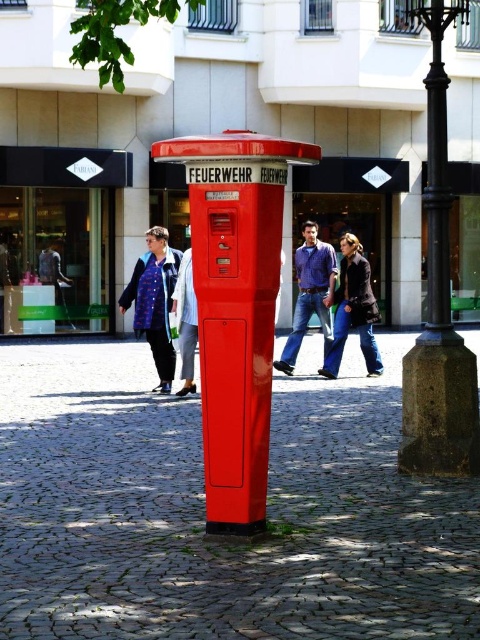
Does blue plaid coat at center appear on the right side of denim jeans at center?

No, blue plaid coat at center is not to the right of denim jeans at center.

This screenshot has width=480, height=640. What do you see at coordinates (155, 301) in the screenshot?
I see `blue plaid coat at center` at bounding box center [155, 301].

Identify the location of blue plaid coat at center. (155, 301).

Is smooth cobblestone pavement at center positioned behind matte red fire alarm at center?

No.

Does smooth cobblestone pavement at center have a lesser height compared to matte red fire alarm at center?

Indeed, smooth cobblestone pavement at center has a lesser height compared to matte red fire alarm at center.

The width and height of the screenshot is (480, 640). I want to click on smooth cobblestone pavement at center, so click(204, 509).

At what (x,y) coordinates should I click in order to perform the action: click on smooth cobblestone pavement at center. Please return your answer as a coordinate pair (x, y). The height and width of the screenshot is (640, 480). Looking at the image, I should click on (204, 509).

Does dark blue jeans at center appear under blue denim jacket at center?

Incorrect, dark blue jeans at center is not positioned below blue denim jacket at center.

Who is more distant from viewer, (338,346) or (180,314)?

Point (338,346)

Between point (365, 296) and point (178, 276), which one is positioned in front?

Point (178, 276) is more forward.

This screenshot has height=640, width=480. Identify the location of dark blue jeans at center. (352, 308).